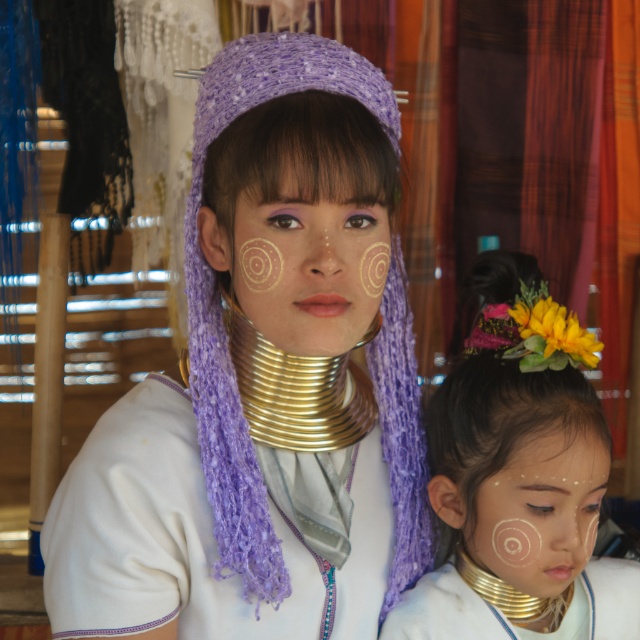
Question: Is white matte face paint at center positioned behind purple knitted headdress at center?

Choices:
 (A) no
 (B) yes

Answer: (B)

Question: Among these points, which one is farthest from the camera?

Choices:
 (A) (289, 563)
 (B) (376, 301)

Answer: (A)

Question: Which point appears closest to the camera in this image?

Choices:
 (A) (188, 536)
 (B) (426, 513)
 (C) (470, 560)

Answer: (A)

Question: Estimate the real-world distances between objects in this image. Which object is closer to the gold metallic neck piece at center?

Choices:
 (A) purple knitted headdress at center
 (B) matte gold necklace at lower center

Answer: (B)

Question: Does white matte face paint at center have a smaller size compared to gold metallic neck rings at center?

Choices:
 (A) no
 (B) yes

Answer: (A)

Question: Does purple knitted headdress at center appear on the right side of gold metallic neck rings at center?

Choices:
 (A) yes
 (B) no

Answer: (A)